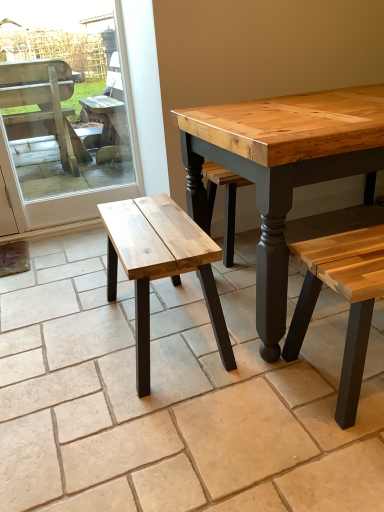
Image resolution: width=384 pixels, height=512 pixels. Identify the location of free spot above natural wood bench at center (from a real-world perspective). (149, 222).